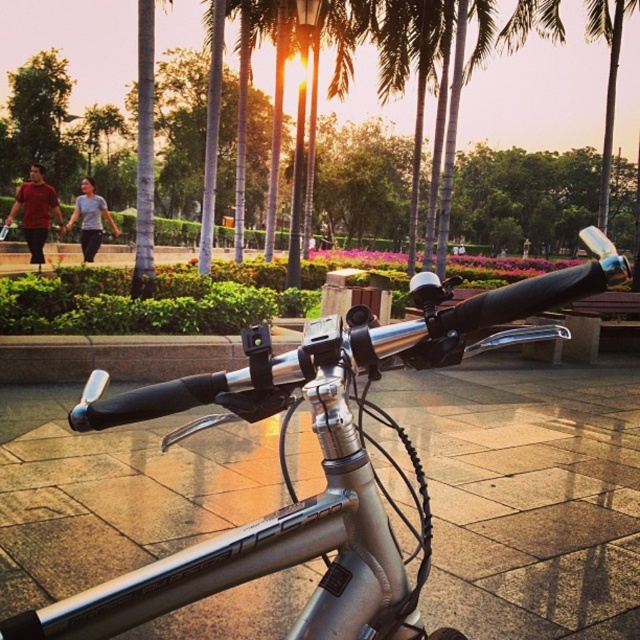
Question: Which of the following is the closest to the observer?

Choices:
 (A) matte red shirt at left
 (B) light blue cotton shirt at center

Answer: (A)

Question: Does silver metallic bicycle handlebars at center have a lesser width compared to matte red shirt at left?

Choices:
 (A) no
 (B) yes

Answer: (B)

Question: Which object is farther from the camera taking this photo?

Choices:
 (A) light blue cotton shirt at center
 (B) matte red shirt at left

Answer: (A)

Question: Is silver metallic bicycle handlebars at center above matte red shirt at left?

Choices:
 (A) no
 (B) yes

Answer: (A)

Question: Which object is farther from the camera taking this photo?

Choices:
 (A) silver metallic bicycle handlebars at center
 (B) matte red shirt at left

Answer: (B)

Question: Does matte red shirt at left appear over light blue cotton shirt at center?

Choices:
 (A) yes
 (B) no

Answer: (B)